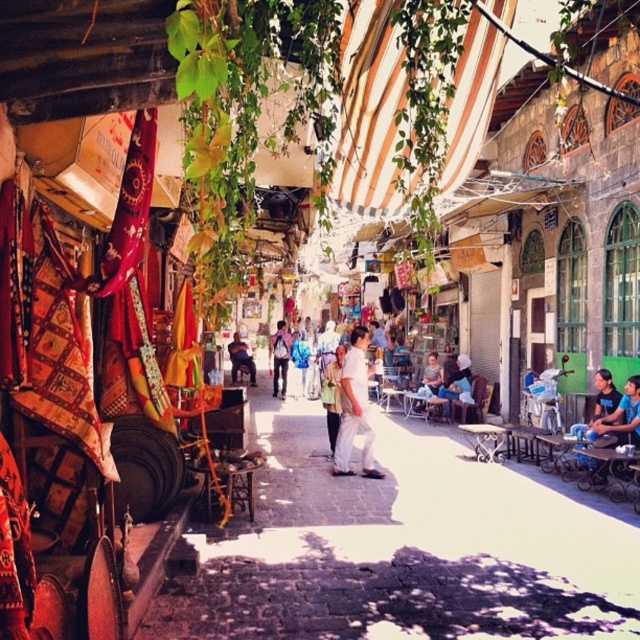
Does white cotton shirt at center come in front of light brown leather backpack at center?

That is True.

Is white cotton shirt at center shorter than light brown leather backpack at center?

Incorrect, white cotton shirt at center's height does not fall short of light brown leather backpack at center's.

Is point (368, 445) positioned in front of point (276, 326)?

Yes, it is.

Where is `white cotton shirt at center`? white cotton shirt at center is located at coordinates (355, 408).

Between white fabric at center and light blue fabric at center, which one is positioned higher?

light blue fabric at center is higher up.

Does white fabric at center have a greater height compared to light blue fabric at center?

No.

The width and height of the screenshot is (640, 640). Find the location of `white fabric at center`. white fabric at center is located at coordinates (401, 550).

Which of these two, light blue fabric at center or dark brown leather bag at center, stands shorter?

Standing shorter between the two is light blue fabric at center.

Does light blue fabric at center appear on the right side of dark brown leather bag at center?

Yes, light blue fabric at center is to the right of dark brown leather bag at center.

The image size is (640, 640). I want to click on light blue fabric at center, so click(452, 381).

Locate an element on the screen. The width and height of the screenshot is (640, 640). light blue fabric at center is located at coordinates (452, 381).